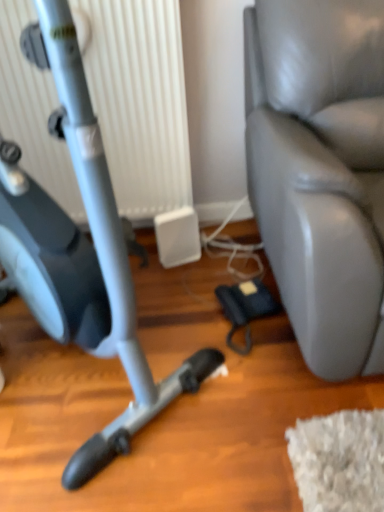
Question: Does matte gray stationary bicycle at left lie in front of white plastic radiator at upper left?

Choices:
 (A) yes
 (B) no

Answer: (A)

Question: Considering the relative positions of matte gray stationary bicycle at left and white plastic radiator at upper left in the image provided, is matte gray stationary bicycle at left to the right of white plastic radiator at upper left from the viewer's perspective?

Choices:
 (A) no
 (B) yes

Answer: (A)

Question: Is the position of matte gray stationary bicycle at left more distant than that of white plastic radiator at upper left?

Choices:
 (A) no
 (B) yes

Answer: (A)

Question: Does matte gray stationary bicycle at left turn towards white plastic radiator at upper left?

Choices:
 (A) no
 (B) yes

Answer: (A)

Question: Is matte gray stationary bicycle at left at the left side of white plastic radiator at upper left?

Choices:
 (A) no
 (B) yes

Answer: (B)

Question: Based on their positions, is white plastic radiator at upper left located to the left or right of matte gray stationary bicycle at left?

Choices:
 (A) left
 (B) right

Answer: (B)

Question: In terms of width, does white plastic radiator at upper left look wider or thinner when compared to matte gray stationary bicycle at left?

Choices:
 (A) wide
 (B) thin

Answer: (B)

Question: Considering the positions of white plastic radiator at upper left and matte gray stationary bicycle at left in the image, is white plastic radiator at upper left bigger or smaller than matte gray stationary bicycle at left?

Choices:
 (A) small
 (B) big

Answer: (A)

Question: Choose the correct answer: Is white plastic radiator at upper left inside matte gray stationary bicycle at left or outside it?

Choices:
 (A) outside
 (B) inside

Answer: (A)

Question: Considering the positions of point (102, 224) and point (380, 207), is point (102, 224) closer or farther from the camera than point (380, 207)?

Choices:
 (A) closer
 (B) farther

Answer: (A)

Question: Considering the positions of matte gray stationary bicycle at left and leather swivel chair at right in the image, is matte gray stationary bicycle at left taller or shorter than leather swivel chair at right?

Choices:
 (A) tall
 (B) short

Answer: (A)

Question: Is matte gray stationary bicycle at left in front of or behind leather swivel chair at right in the image?

Choices:
 (A) behind
 (B) front

Answer: (B)

Question: From the image's perspective, is matte gray stationary bicycle at left positioned above or below leather swivel chair at right?

Choices:
 (A) below
 (B) above

Answer: (A)

Question: Which is correct: matte gray stationary bicycle at left is inside white plastic radiator at upper left, or outside of it?

Choices:
 (A) outside
 (B) inside

Answer: (A)

Question: Is matte gray stationary bicycle at left wider or thinner than white plastic radiator at upper left?

Choices:
 (A) thin
 (B) wide

Answer: (B)